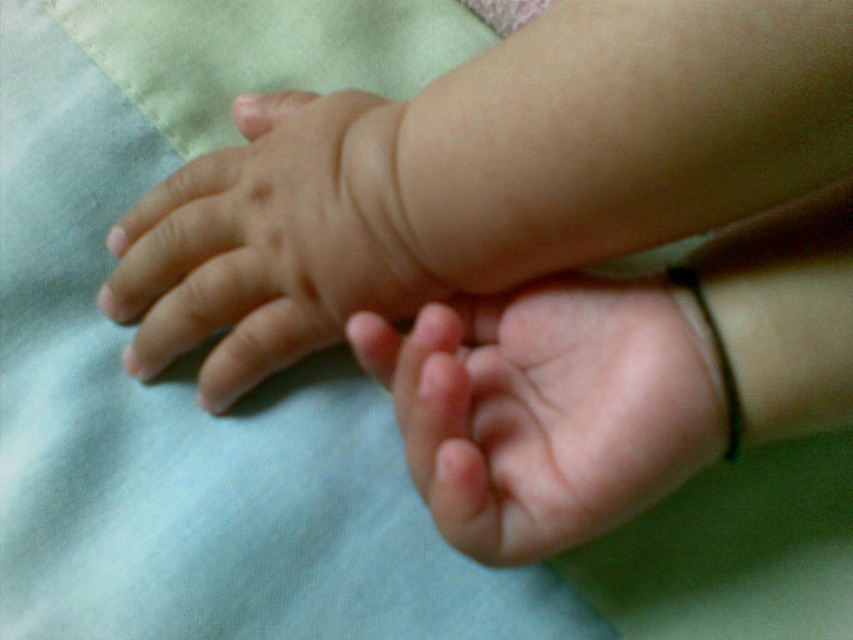
Can you confirm if smooth skin hand at upper left is wider than pink soft skin at center?

Yes.

Which is more to the right, smooth skin hand at upper left or pink soft skin at center?

pink soft skin at center is more to the right.

Who is more distant from viewer, (x=140, y=268) or (x=387, y=342)?

The point (x=140, y=268) is behind.

Where is `smooth skin hand at upper left`? Image resolution: width=853 pixels, height=640 pixels. smooth skin hand at upper left is located at coordinates (267, 243).

Who is lower down, smooth skin hand at center or pink soft skin at center?

smooth skin hand at center is lower down.

Is point (547, 301) behind point (368, 324)?

Yes, point (547, 301) is behind point (368, 324).

Does point (566, 288) come behind point (347, 324)?

Yes, it is behind point (347, 324).

Identify the location of smooth skin hand at center. The image size is (853, 640). (555, 412).

Can you confirm if smooth skin hand at center is shorter than smooth skin hand at upper left?

Yes, smooth skin hand at center is shorter than smooth skin hand at upper left.

This screenshot has height=640, width=853. Describe the element at coordinates (555, 412) in the screenshot. I see `smooth skin hand at center` at that location.

Image resolution: width=853 pixels, height=640 pixels. Identify the location of smooth skin hand at center. (555, 412).